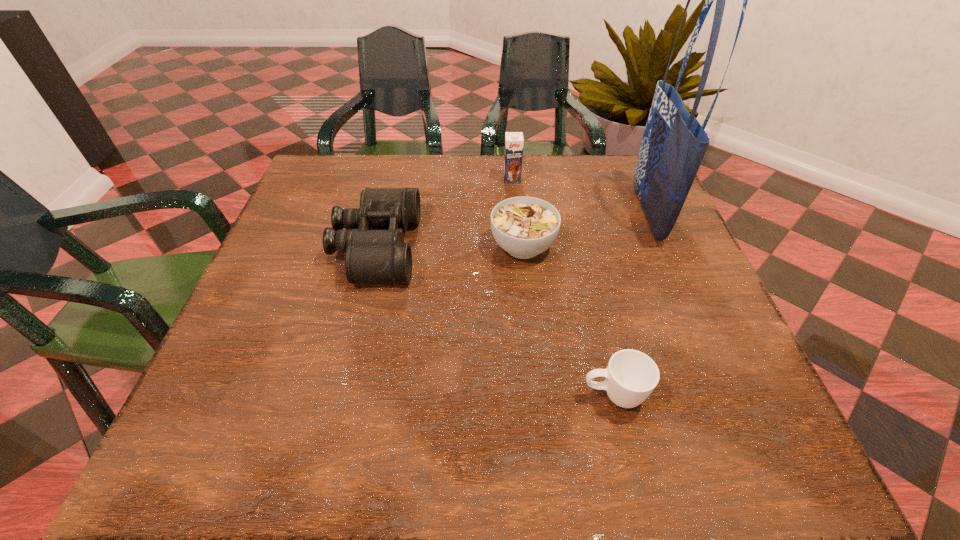
Where is `vacant point located 0.380m on the front label of the second tallest object`? vacant point located 0.380m on the front label of the second tallest object is located at coordinates (522, 289).

Locate an element on the screen. vacant space located at the eyepieces of the third tallest object is located at coordinates (473, 247).

Locate an element on the screen. The image size is (960, 540). free space located 0.300m on the front of the soup bowl is located at coordinates (539, 397).

Locate an element on the screen. The image size is (960, 540). vacant point located 0.090m with the handle on the side of the cup is located at coordinates (527, 395).

The image size is (960, 540). What are the coordinates of `vacant space situated with the handle on the side of the cup` in the screenshot? It's located at (551, 395).

The height and width of the screenshot is (540, 960). Identify the location of vacant space positioned 0.300m with the handle on the side of the cup. (402, 395).

Find the location of a particular element. The width and height of the screenshot is (960, 540). shopping bag that is at the far edge is located at coordinates (674, 143).

Identify the location of chocolate milk present at the far edge. pyautogui.click(x=514, y=141).

Where is `object located in the near edge section of the desktop`? object located in the near edge section of the desktop is located at coordinates click(631, 376).

Where is `object that is at the left edge`? Image resolution: width=960 pixels, height=540 pixels. object that is at the left edge is located at coordinates (373, 240).